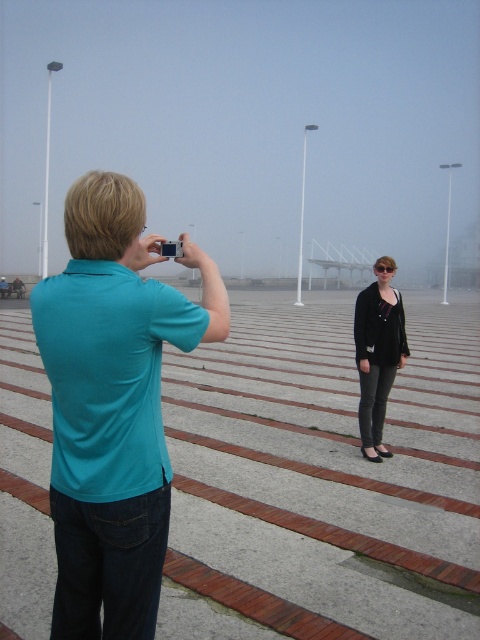
Question: Which point is closer to the camera?

Choices:
 (A) black matte cardigan at center
 (B) teal fabric shirt at left

Answer: (B)

Question: Is teal fabric shirt at left positioned behind black matte cardigan at center?

Choices:
 (A) yes
 (B) no

Answer: (B)

Question: Is teal fabric shirt at left smaller than black matte cardigan at center?

Choices:
 (A) yes
 (B) no

Answer: (B)

Question: Can you confirm if teal fabric shirt at left is wider than black matte cardigan at center?

Choices:
 (A) no
 (B) yes

Answer: (B)

Question: Which point is closer to the camera?

Choices:
 (A) black matte cardigan at center
 (B) teal fabric shirt at left

Answer: (B)